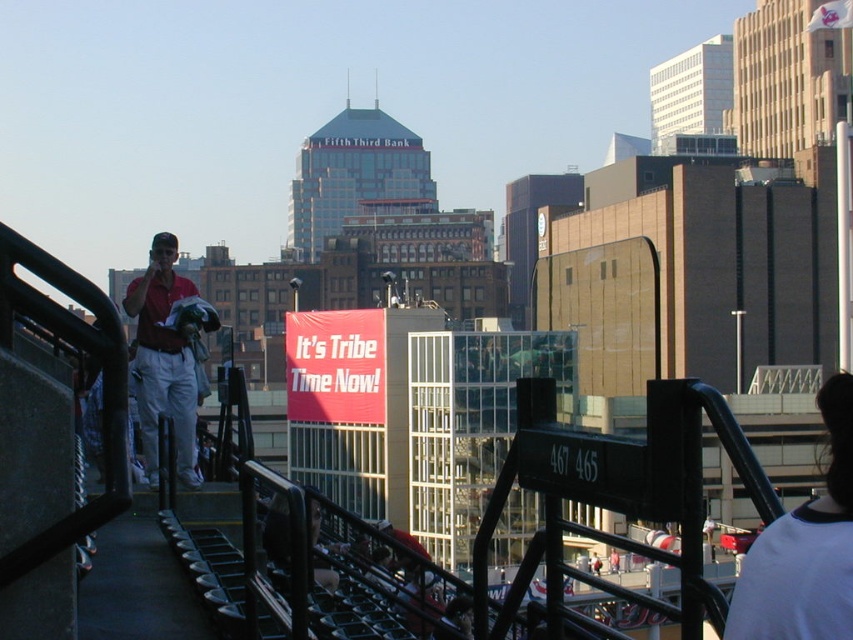
You are standing at the point marked by the coordinates point (804, 548). What object is located at those coordinates?

The point (804, 548) marks the white jersey at upper right.

You are standing at the bottom of the stadium steps and want to locate the white jersey at upper right. According to the coordinates provided, in which direction should you look to find it?

The white jersey at upper right is located at coordinates point (x=804, y=548), so you should look towards the upper right direction to find it.

You are standing at the point labeled as point (x=846, y=388) in the image. There is a red banner with the text

The distance between you and the red banner with the text